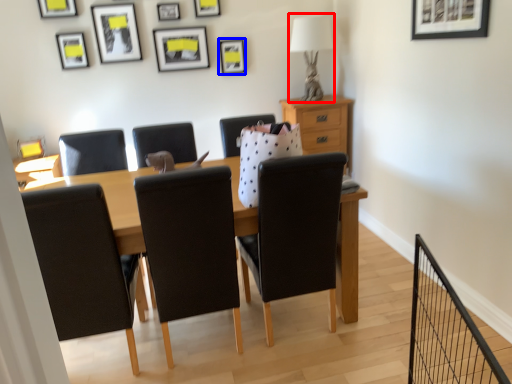
Question: Among these objects, which one is nearest to the camera, table lamp (highlighted by a red box) or picture frame (highlighted by a blue box)?

Choices:
 (A) table lamp
 (B) picture frame

Answer: (A)